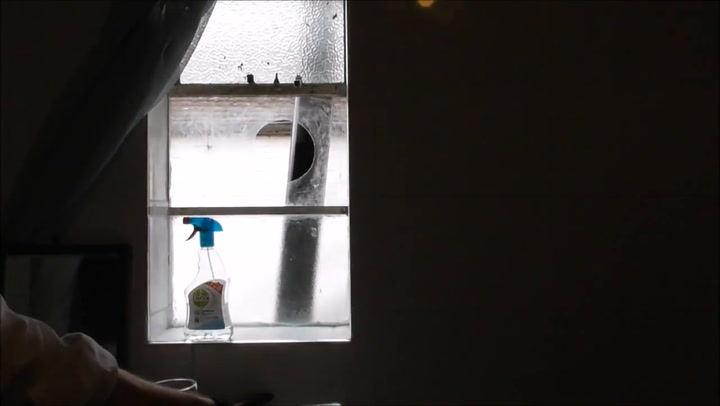
Image resolution: width=720 pixels, height=406 pixels. Find the location of `black wall`. black wall is located at coordinates (574, 309).